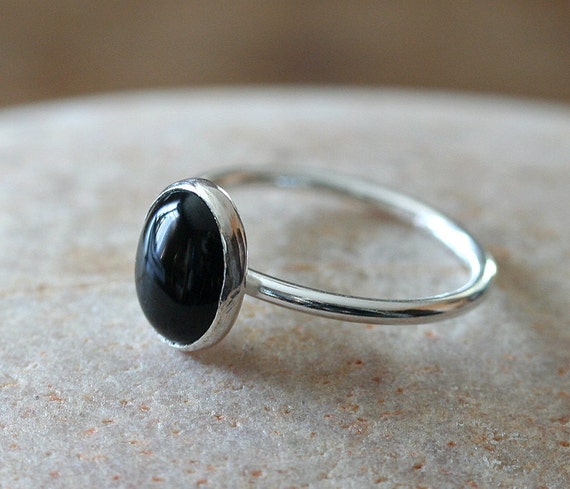
At what (x,y) coordinates should I click in order to perform the action: click on white carpet. Please return your answer as a coordinate pair (x, y). Looking at the image, I should click on (251, 449).